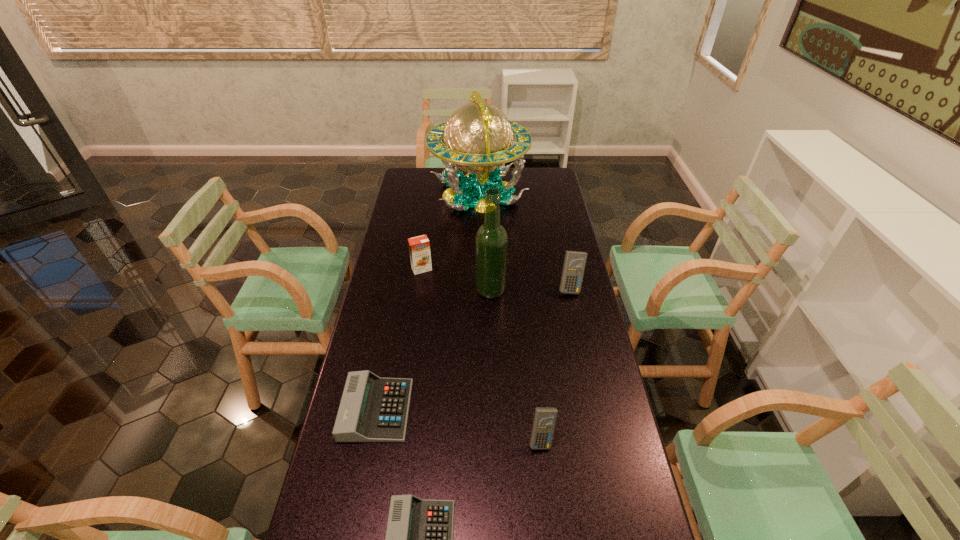
Locate an element on the screen. free space located on the front of the globe is located at coordinates (478, 272).

Identify the location of vacant space positioned on the left of the liquor. The width and height of the screenshot is (960, 540). (396, 289).

Where is `vacant space located 0.280m on the front-facing side of the farthest calculator`? vacant space located 0.280m on the front-facing side of the farthest calculator is located at coordinates (586, 360).

You are a GUI agent. You are given a task and a screenshot of the screen. Output one action in this format:
    pyautogui.click(x=<x>, y=<y>)
    Task: Click on the vacant area located on the back of the orange juice
    
    Given the screenshot: What is the action you would take?
    425,243

Locate an element on the screen. This screenshot has width=960, height=540. vacant space situated on the front-facing side of the left blue calculator is located at coordinates (545, 475).

The width and height of the screenshot is (960, 540). Find the location of `vacant position located 0.340m on the right of the bigger gray calculator`. vacant position located 0.340m on the right of the bigger gray calculator is located at coordinates coord(529,410).

This screenshot has width=960, height=540. In order to click on object that is at the far edge in this screenshot , I will do `click(478, 137)`.

The width and height of the screenshot is (960, 540). I want to click on globe located at the left edge, so click(x=478, y=137).

Identify the location of orange juice that is at the left edge. (419, 247).

The width and height of the screenshot is (960, 540). Find the location of `calculator that is at the left edge`. calculator that is at the left edge is located at coordinates (372, 409).